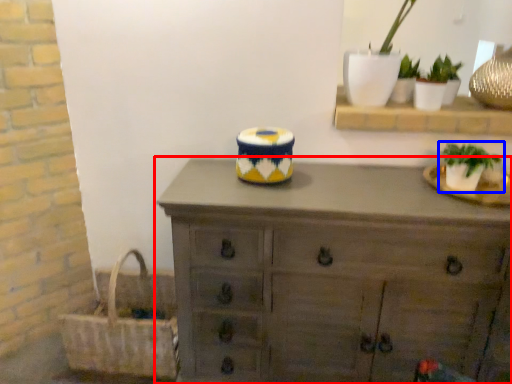
Question: Among these objects, which one is nearest to the camera, chest of drawers (highlighted by a red box) or houseplant (highlighted by a blue box)?

Choices:
 (A) chest of drawers
 (B) houseplant

Answer: (A)